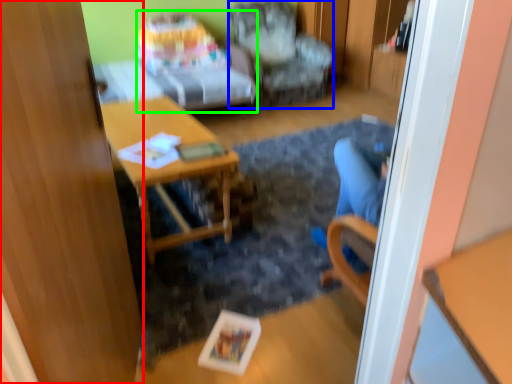
Question: Considering the real-world distances, which object is closest to glass door (highlighted by a red box)? chair (highlighted by a blue box) or studio couch (highlighted by a green box).

Choices:
 (A) chair
 (B) studio couch

Answer: (B)